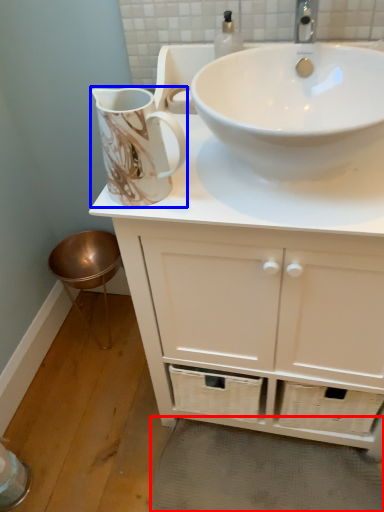
Question: Among these objects, which one is nearest to the camera, bath mat (highlighted by a red box) or jug (highlighted by a blue box)?

Choices:
 (A) bath mat
 (B) jug

Answer: (B)